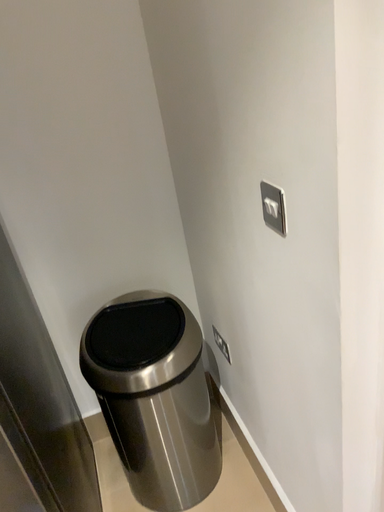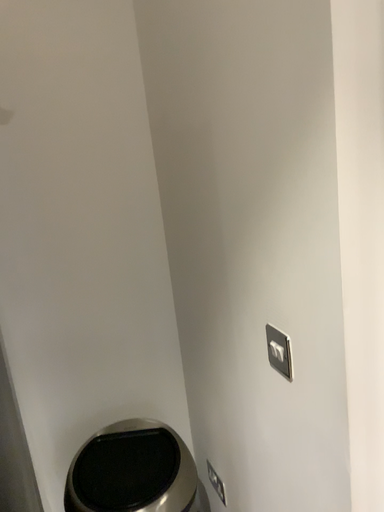
Question: Which way did the camera rotate in the video?

Choices:
 (A) rotated downward
 (B) rotated upward

Answer: (B)